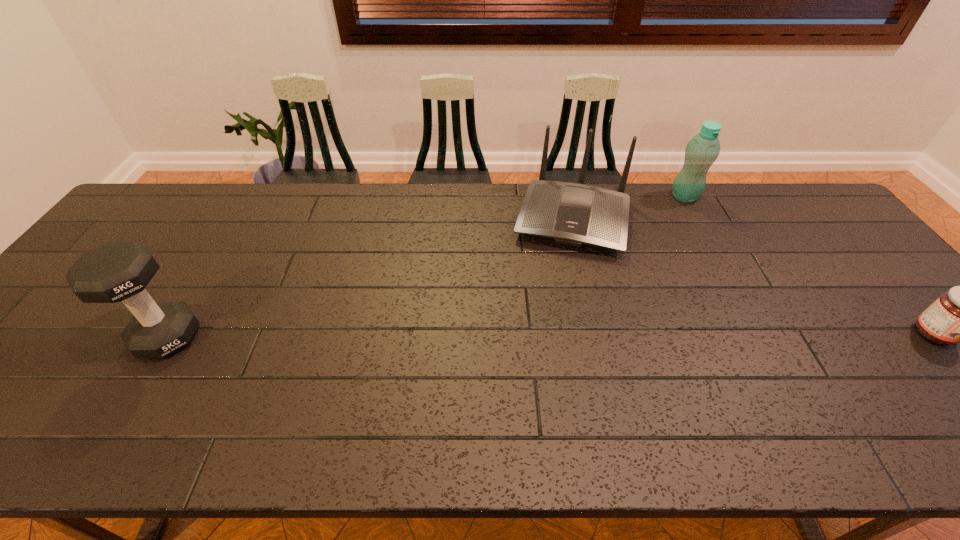
You are a GUI agent. You are given a task and a screenshot of the screen. Output one action in this format:
    pyautogui.click(x=<x>, y=<y>)
    Task: Click on the leftmost object
    
    Given the screenshot: What is the action you would take?
    pyautogui.click(x=116, y=271)

The height and width of the screenshot is (540, 960). Find the location of `the second object from left to right`. the second object from left to right is located at coordinates (574, 214).

Identify the location of the third object from left to right. (702, 150).

Image resolution: width=960 pixels, height=540 pixels. Identify the location of free point located on the right of the leftmost object. (234, 337).

I want to click on free space located 0.060m on the front-facing side of the second object from left to right, so click(560, 273).

Locate an element on the screen. This screenshot has height=540, width=960. vacant space located 0.330m on the front-facing side of the second object from left to right is located at coordinates point(543,353).

The image size is (960, 540). I want to click on blank area located on the front-facing side of the second object from left to right, so click(x=543, y=353).

Find the location of a particular element. This screenshot has width=960, height=540. vacant area located 0.400m at the front cap of the second object from right to left is located at coordinates (671, 289).

Locate an element on the screen. free space located at the front cap of the second object from right to left is located at coordinates (676, 255).

The image size is (960, 540). I want to click on free space located at the front cap of the second object from right to left, so click(674, 265).